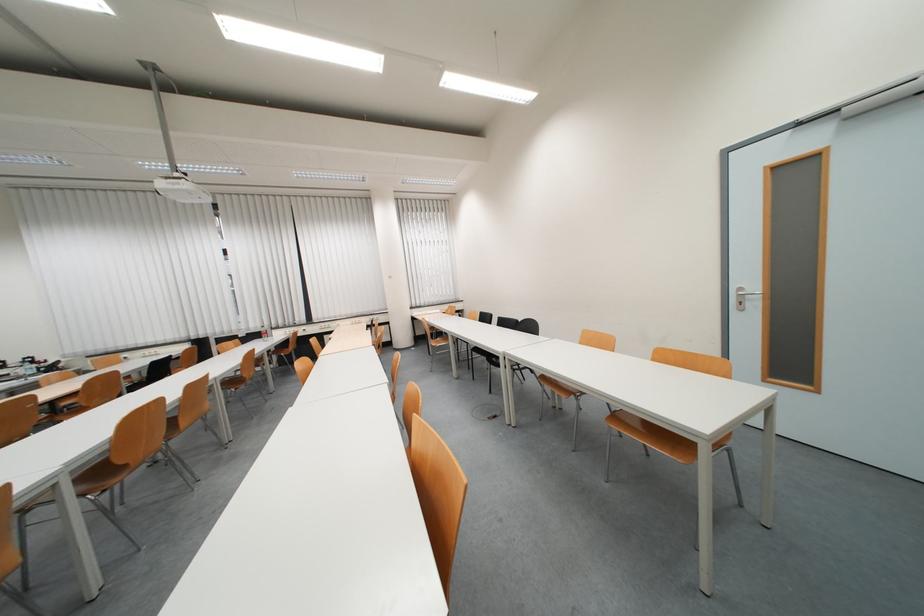
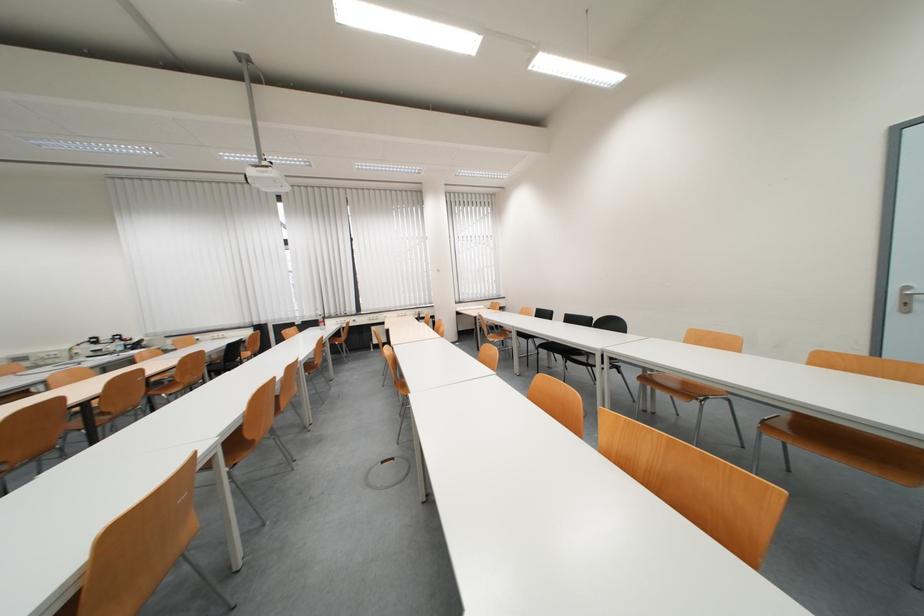
Question: The camera is either moving clockwise (left) or counter-clockwise (right) around the object. The first image is from the beginning of the video and the second image is from the end. Is the camera moving left or right when shooting the video?

Choices:
 (A) Left
 (B) Right

Answer: (B)